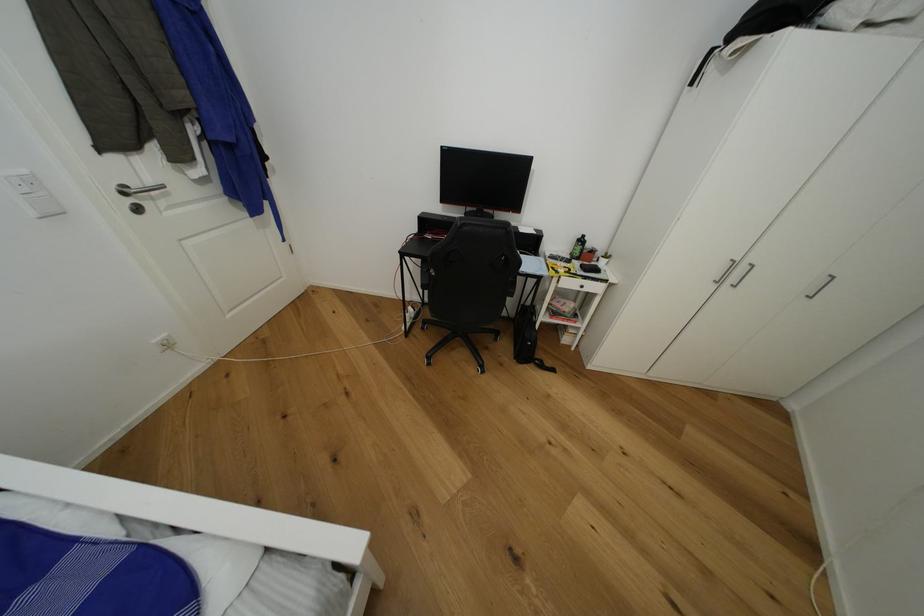
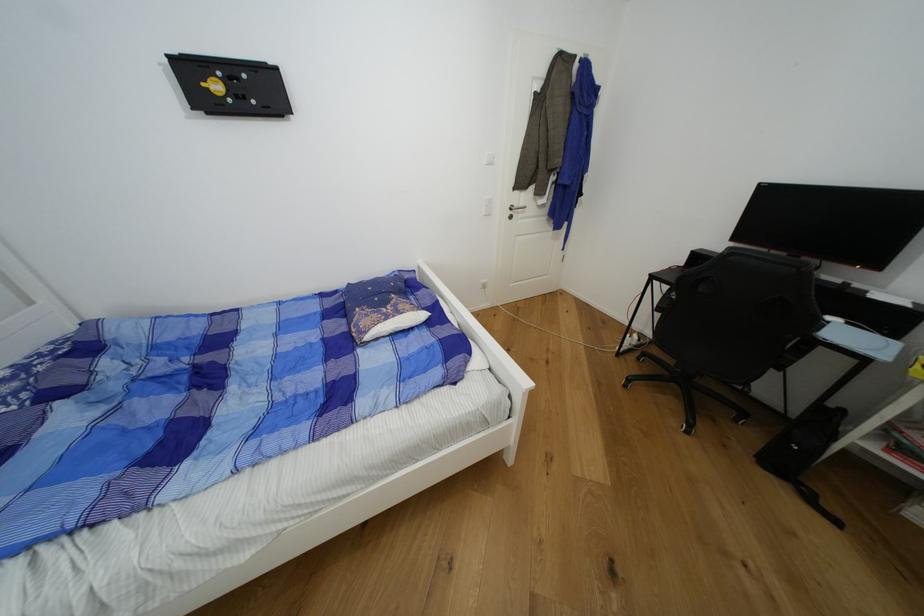
The point at (140, 185) is marked in the first image. Where is the corresponding point in the second image?

(521, 207)